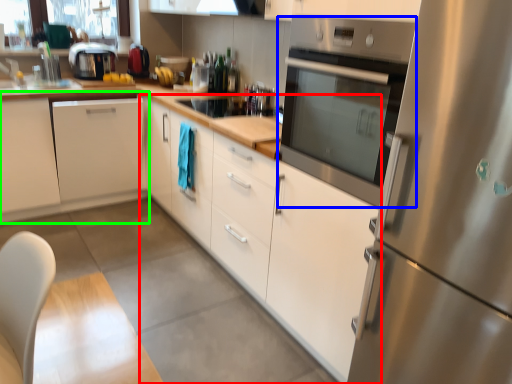
Question: Based on their relative distances, which object is farther from cabinetry (highlighted by a red box)? Choose from home appliance (highlighted by a blue box) and cabinetry (highlighted by a green box).

Choices:
 (A) home appliance
 (B) cabinetry

Answer: (B)